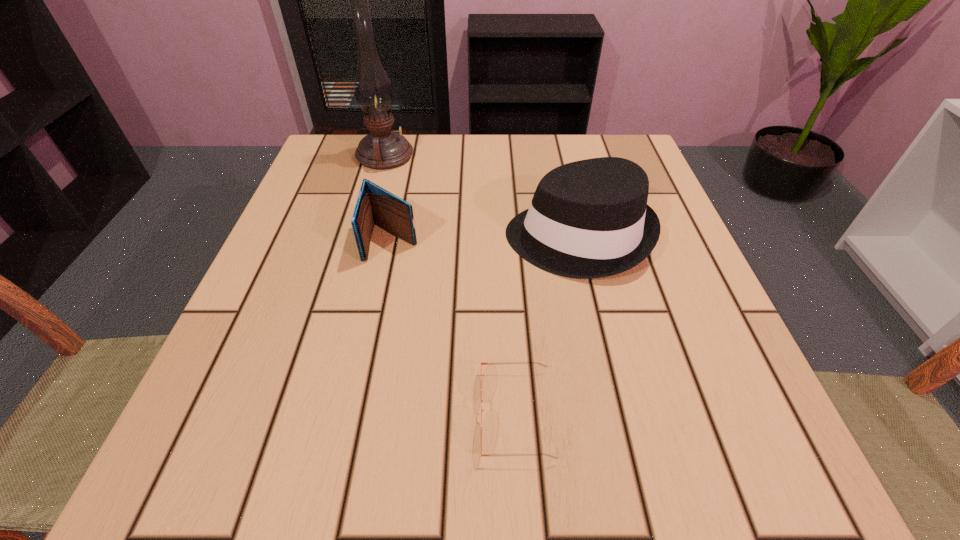
Identify the location of blank area at the near left corner. This screenshot has width=960, height=540. 314,428.

Identify the location of vacant space at the near right corner of the desktop. Image resolution: width=960 pixels, height=540 pixels. [x=760, y=494].

At what (x,y) coordinates should I click in order to perform the action: click on vacant area that lies between the third shortest object and the oil lamp. Please return your answer as a coordinate pair (x, y). This screenshot has height=540, width=960. Looking at the image, I should click on (481, 197).

You are a GUI agent. You are given a task and a screenshot of the screen. Output one action in this format:
    pyautogui.click(x=<x>, y=<y>)
    Task: Click on the free point between the fedora and the tallest object
    The height and width of the screenshot is (540, 960).
    Given the screenshot: What is the action you would take?
    tap(481, 197)

This screenshot has height=540, width=960. I want to click on free space that is in between the fedora and the wallet, so click(485, 239).

I want to click on empty space between the fedora and the farthest object, so click(481, 197).

You are a GUI agent. You are given a task and a screenshot of the screen. Output one action in this format:
    pyautogui.click(x=<x>, y=<y>)
    Task: Click on the vacant area that lies between the second shortest object and the sunglasses
    
    Given the screenshot: What is the action you would take?
    pyautogui.click(x=454, y=327)

Locate an element on the screen. The height and width of the screenshot is (540, 960). free point between the sunglasses and the wallet is located at coordinates (454, 327).

Find the location of a particular element. This screenshot has width=960, height=540. free space between the fedora and the wallet is located at coordinates (485, 239).

The image size is (960, 540). I want to click on free space between the oil lamp and the sunglasses, so click(450, 285).